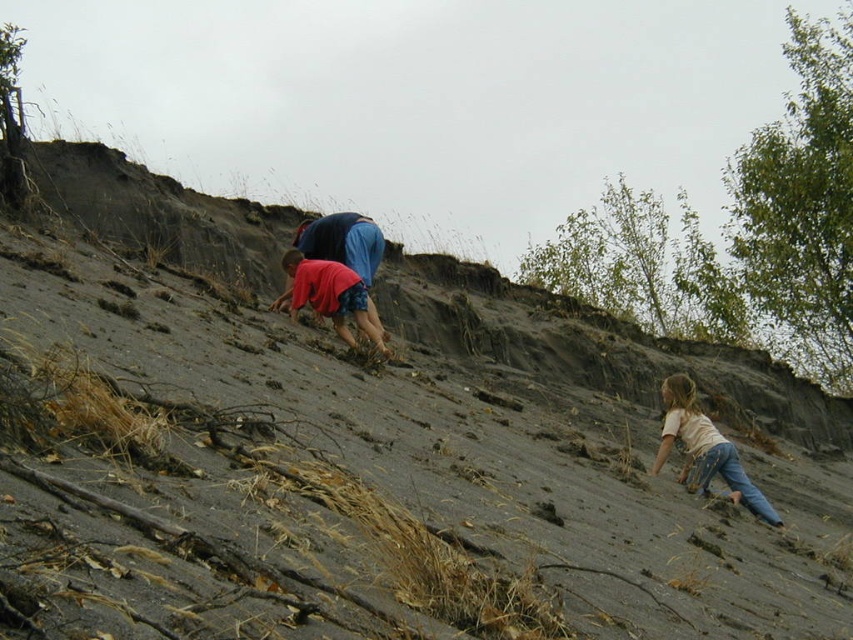
You are a drone operator tasked with capturing aerial footage of the sandy hillside scene. The drone has a camera with a maximum zoom range of 10 meters. You need to capture a close shot of both the light beige denim jeans at lower right and the matte red shirt at center simultaneously. Is this possible with the current zoom range?

The distance between the light beige denim jeans at lower right and the matte red shirt at center is 13.69 meters. Since the drone camera can only zoom up to 10 meters, it cannot capture both objects within the same frame at this distance. Therefore, it is not possible to capture both simultaneously with the current zoom range.